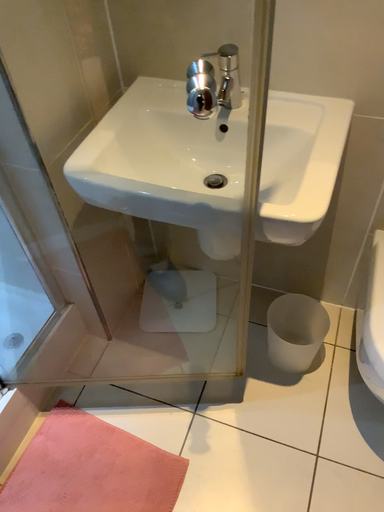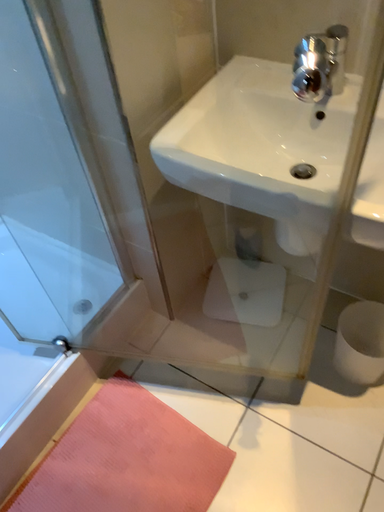
Question: Which way did the camera rotate in the video?

Choices:
 (A) rotated right
 (B) rotated left

Answer: (B)